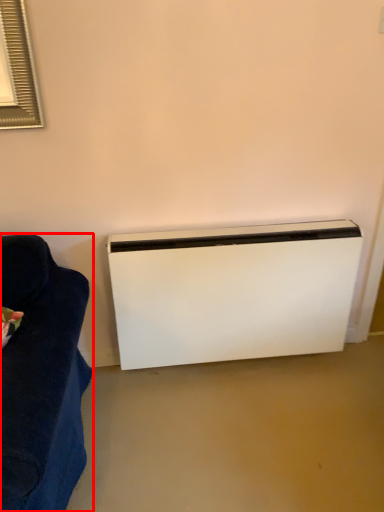
Question: From the image's perspective, where is furniture (annotated by the red box) located relative to home appliance?

Choices:
 (A) above
 (B) below

Answer: (B)